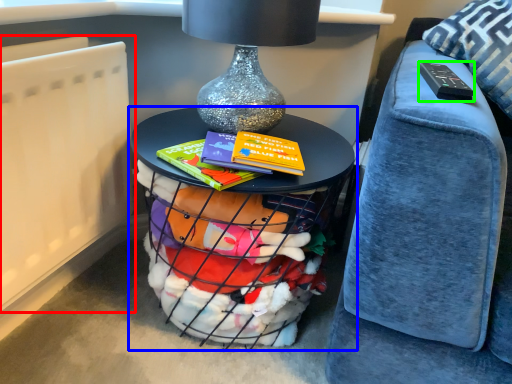
Question: Which object is positioned farthest from radiator (highlighted by a red box)? Select from table (highlighted by a blue box) and remote (highlighted by a green box).

Choices:
 (A) table
 (B) remote

Answer: (B)